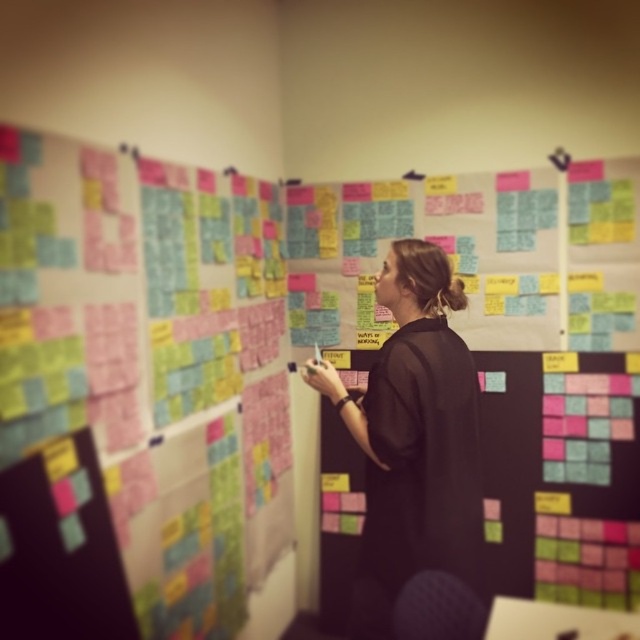
You are a fashion designer who needs to place a new design sketch next to both the multicolored sticky notes at left and the black matte dress at center without overlapping them. What is the minimum distance you should maintain between the new sketch and each object?

The multicolored sticky notes at left and black matte dress at center are 26.28 inches apart. To place the new design sketch next to both without overlapping, the minimum distance should be half of 26.28 inches, which is approximately 13.14 inches from each object.

You are a fashion designer who needs to decide which item to place on a narrow shelf. You have the multicolored sticky notes at left and the black matte dress at center. Based on their thickness, which item can fit better on the shelf?

The multicolored sticky notes at left is thinner than the black matte dress at center, so the multicolored sticky notes at left can fit better on the narrow shelf.

You are standing in front of a wall covered with colorful sticky notes and holding a marker. You want to place your new note exactly at the point marked as point [144,365]. However, there are multicolored sticky notes at left. Can you place your note there without overlapping any existing notes?

The point [144,365] is on multicolored sticky notes at left, so placing a new note there would overlap with existing notes.